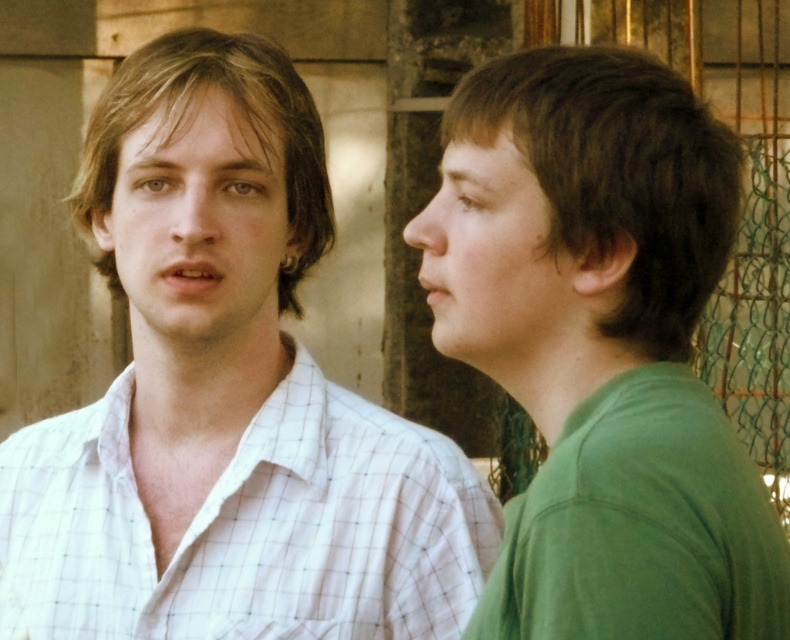
How much distance is there between green matte shirt at right and white checkered shirt at left?

green matte shirt at right and white checkered shirt at left are 4.69 feet apart from each other.

Does green matte shirt at right appear on the left side of white checkered shirt at left?

Incorrect, green matte shirt at right is not on the left side of white checkered shirt at left.

This screenshot has height=640, width=790. In order to click on green matte shirt at right in this screenshot , I will do `click(600, 346)`.

The image size is (790, 640). What are the coordinates of `green matte shirt at right` in the screenshot? It's located at (600, 346).